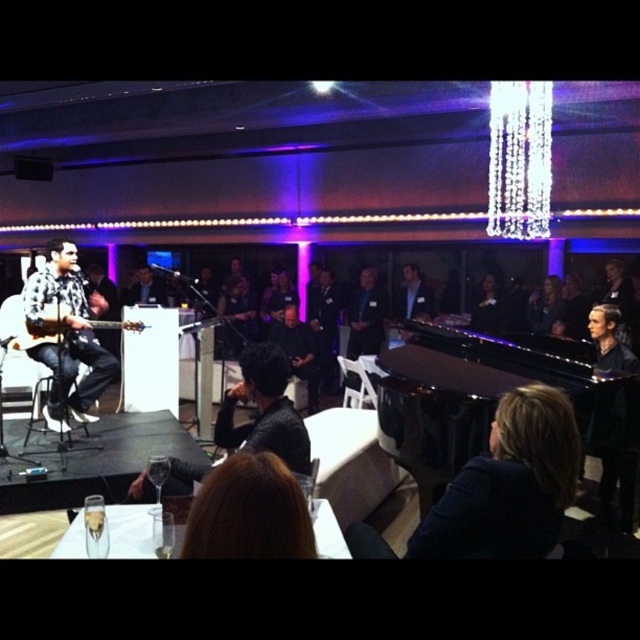
Question: Which point is farther to the camera?

Choices:
 (A) black polished piano at center
 (B) plaid shirt at left
 (C) matte black guitar at left

Answer: (B)

Question: Can you confirm if dark blue fabric at lower right is positioned to the left of plaid shirt at left?

Choices:
 (A) no
 (B) yes

Answer: (A)

Question: Considering the relative positions of plaid shirt at left and matte black guitar at left in the image provided, where is plaid shirt at left located with respect to matte black guitar at left?

Choices:
 (A) right
 (B) left

Answer: (B)

Question: Considering the real-world distances, which object is closest to the smooth black hair at upper right?

Choices:
 (A) black polished piano at center
 (B) dark blue fabric at lower right
 (C) plaid shirt at left
 (D) matte black guitar at left

Answer: (A)

Question: Considering the real-world distances, which object is farthest from the dark blue fabric at lower right?

Choices:
 (A) black polished piano at center
 (B) matte black guitar at left

Answer: (B)

Question: Is dark blue fabric at lower right smaller than smooth black hair at upper right?

Choices:
 (A) no
 (B) yes

Answer: (B)